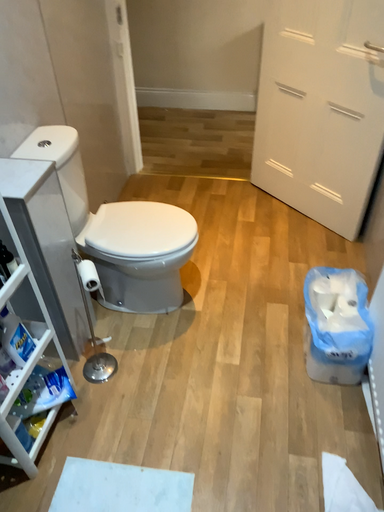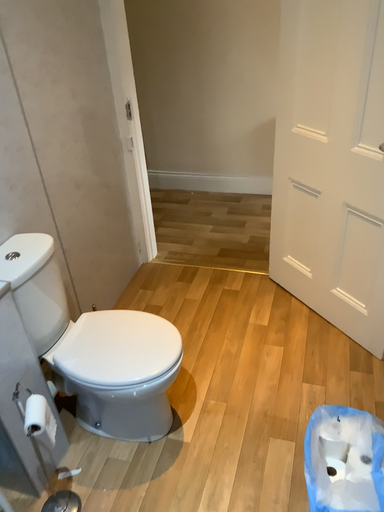
Question: Which way did the camera rotate in the video?

Choices:
 (A) rotated upward
 (B) rotated downward

Answer: (A)